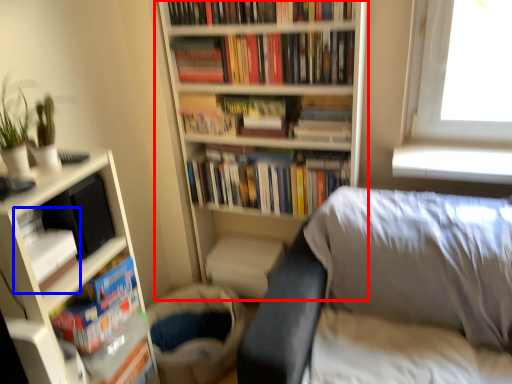
Question: Which point is further to the camera, bookcase (highlighted by a red box) or book (highlighted by a blue box)?

Choices:
 (A) bookcase
 (B) book

Answer: (A)